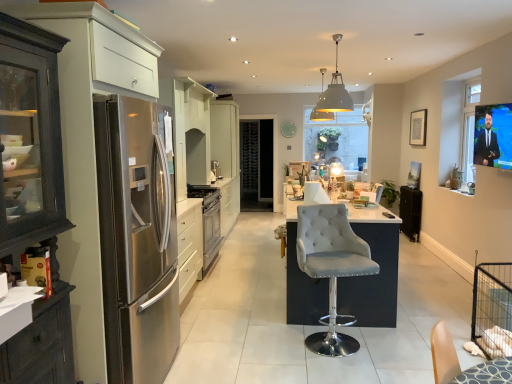
Question: In which direction should I rotate to look at satin silver oven at center, positioned as the 1th appliance in left-to-right order?

Choices:
 (A) right
 (B) left

Answer: (B)

Question: Could you tell me if stainless steel oven at center is facing satin silver refrigerator at left?

Choices:
 (A) yes
 (B) no

Answer: (B)

Question: Considering the relative sizes of stainless steel oven at center and satin silver refrigerator at left in the image provided, is stainless steel oven at center shorter than satin silver refrigerator at left?

Choices:
 (A) yes
 (B) no

Answer: (A)

Question: Can you confirm if stainless steel oven at center is taller than satin silver refrigerator at left?

Choices:
 (A) no
 (B) yes

Answer: (A)

Question: Can you confirm if stainless steel oven at center is thinner than satin silver refrigerator at left?

Choices:
 (A) no
 (B) yes

Answer: (B)

Question: Is satin silver refrigerator at left a part of stainless steel oven at center?

Choices:
 (A) no
 (B) yes

Answer: (A)

Question: Considering the relative sizes of stainless steel oven at center and satin silver refrigerator at left in the image provided, is stainless steel oven at center bigger than satin silver refrigerator at left?

Choices:
 (A) yes
 (B) no

Answer: (B)

Question: Does suede-like gray bar stool at center have a smaller size compared to white glossy cabinet at center?

Choices:
 (A) yes
 (B) no

Answer: (A)

Question: Is suede-like gray bar stool at center facing away from white glossy cabinet at center?

Choices:
 (A) no
 (B) yes

Answer: (B)

Question: Would you say suede-like gray bar stool at center is outside white glossy cabinet at center?

Choices:
 (A) no
 (B) yes

Answer: (B)

Question: Is suede-like gray bar stool at center with white glossy cabinet at center?

Choices:
 (A) yes
 (B) no

Answer: (B)

Question: Is the depth of suede-like gray bar stool at center greater than that of white glossy cabinet at center?

Choices:
 (A) no
 (B) yes

Answer: (A)

Question: Is suede-like gray bar stool at center in front of white glossy cabinet at center?

Choices:
 (A) no
 (B) yes

Answer: (B)

Question: From a real-world perspective, is matte gray pendant light at center under white glossy cabinet at center?

Choices:
 (A) yes
 (B) no

Answer: (B)